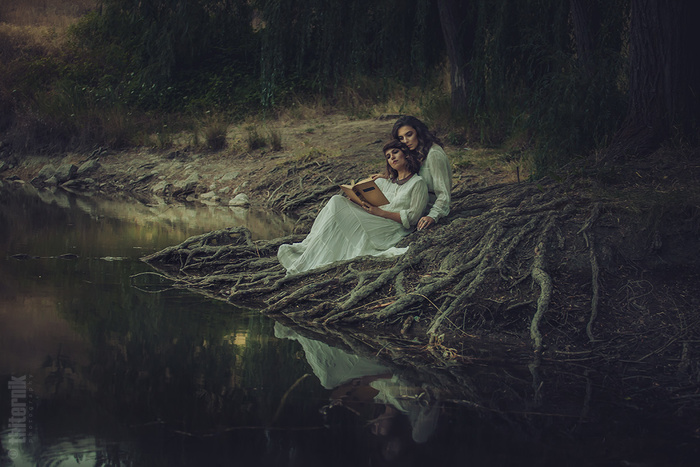
At what (x,y) coordinates should I click in order to perform the action: click on open book. Please return your answer as a coordinate pair (x, y). This screenshot has width=700, height=467. Looking at the image, I should click on (374, 197).